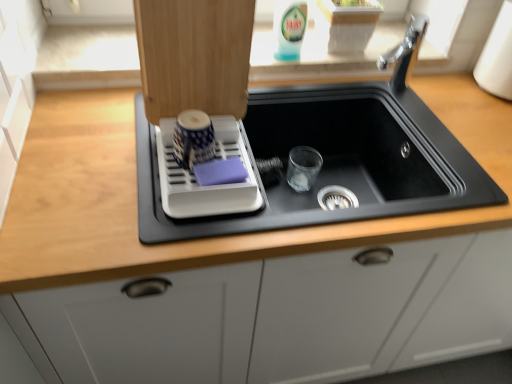
Question: From a real-world perspective, is white plastic dish rack at upper left located beneath black matte sink at center?

Choices:
 (A) no
 (B) yes

Answer: (A)

Question: Can you confirm if white plastic dish rack at upper left is shorter than black matte sink at center?

Choices:
 (A) no
 (B) yes

Answer: (B)

Question: Does white plastic dish rack at upper left turn towards black matte sink at center?

Choices:
 (A) no
 (B) yes

Answer: (A)

Question: Is white plastic dish rack at upper left far from black matte sink at center?

Choices:
 (A) yes
 (B) no

Answer: (B)

Question: Is white plastic dish rack at upper left bigger than black matte sink at center?

Choices:
 (A) no
 (B) yes

Answer: (A)

Question: From the image's perspective, is black matte sink at center above or below translucent plastic bottle at upper center?

Choices:
 (A) below
 (B) above

Answer: (A)

Question: Is black matte sink at center taller or shorter than translucent plastic bottle at upper center?

Choices:
 (A) short
 (B) tall

Answer: (B)

Question: Is black matte sink at center situated inside translucent plastic bottle at upper center or outside?

Choices:
 (A) inside
 (B) outside

Answer: (B)

Question: Based on their positions, is black matte sink at center located to the left or right of translucent plastic bottle at upper center?

Choices:
 (A) right
 (B) left

Answer: (A)

Question: Is translucent plastic bottle at upper center bigger or smaller than white plastic dish rack at upper left?

Choices:
 (A) small
 (B) big

Answer: (A)

Question: Is translucent plastic bottle at upper center in front of or behind white plastic dish rack at upper left in the image?

Choices:
 (A) behind
 (B) front

Answer: (A)

Question: Which is correct: translucent plastic bottle at upper center is inside white plastic dish rack at upper left, or outside of it?

Choices:
 (A) inside
 (B) outside

Answer: (B)

Question: Considering the positions of translucent plastic bottle at upper center and white plastic dish rack at upper left in the image, is translucent plastic bottle at upper center wider or thinner than white plastic dish rack at upper left?

Choices:
 (A) thin
 (B) wide

Answer: (A)

Question: Is white plastic dish rack at upper left to the left or to the right of translucent plastic bottle at upper center in the image?

Choices:
 (A) right
 (B) left

Answer: (B)

Question: Choose the correct answer: Is white plastic dish rack at upper left inside translucent plastic bottle at upper center or outside it?

Choices:
 (A) outside
 (B) inside

Answer: (A)